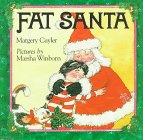
This screenshot has width=143, height=140. I want to click on cover, so click(113, 104).